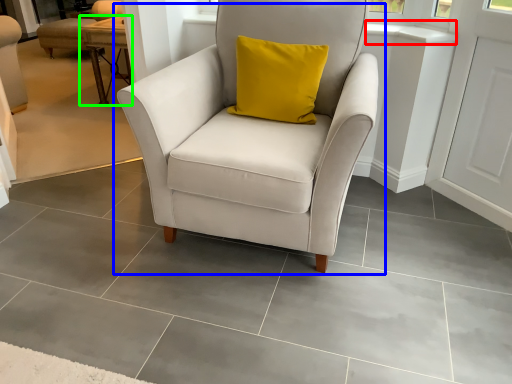
Question: Estimate the real-world distances between objects in this image. Which object is farther from window sill (highlighted by a red box), chair (highlighted by a blue box) or table (highlighted by a green box)?

Choices:
 (A) chair
 (B) table

Answer: (B)